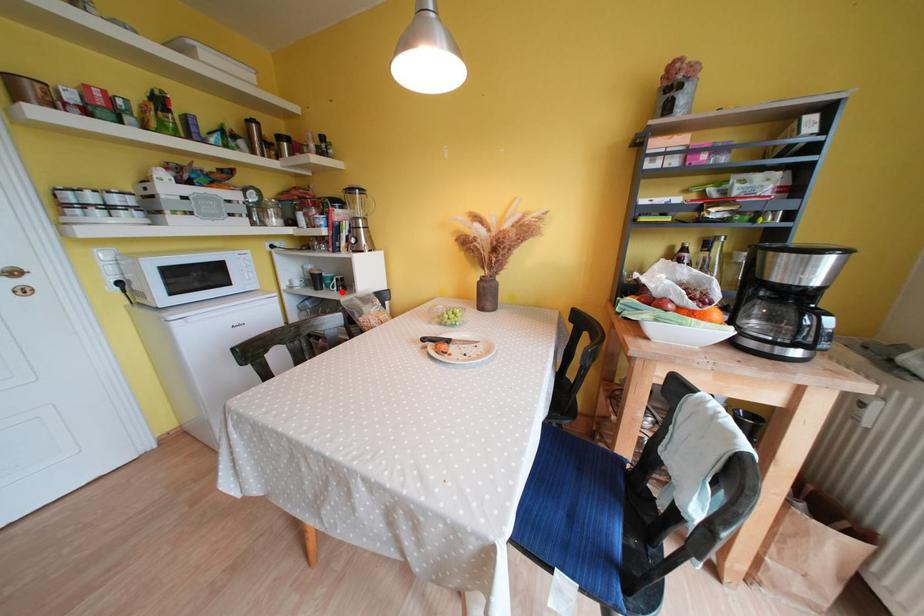
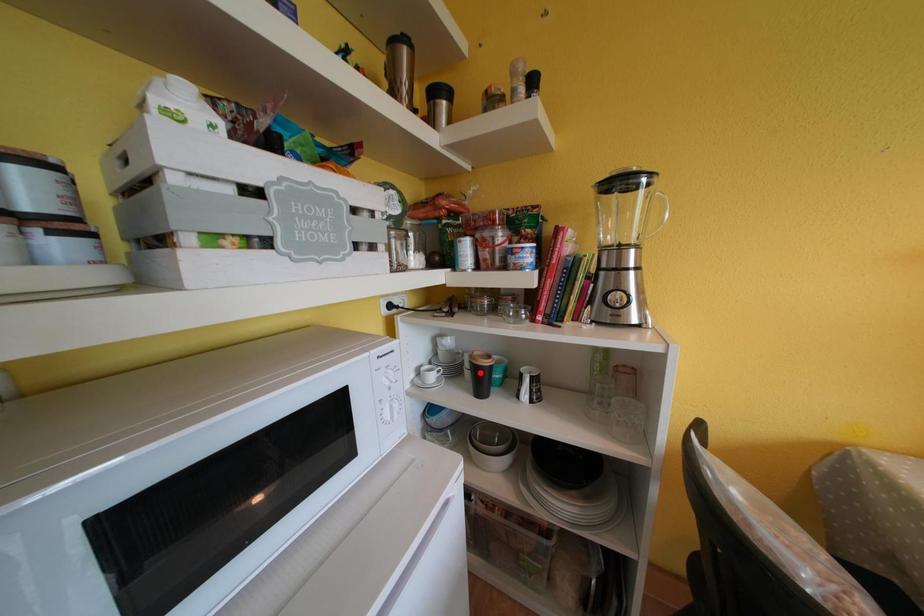
I am providing you with two images of the same scene from different viewpoints. A red point is marked on the first image and another point is marked on the second image. Are the points marked in image1 and image2 representing the same 3D position?

No